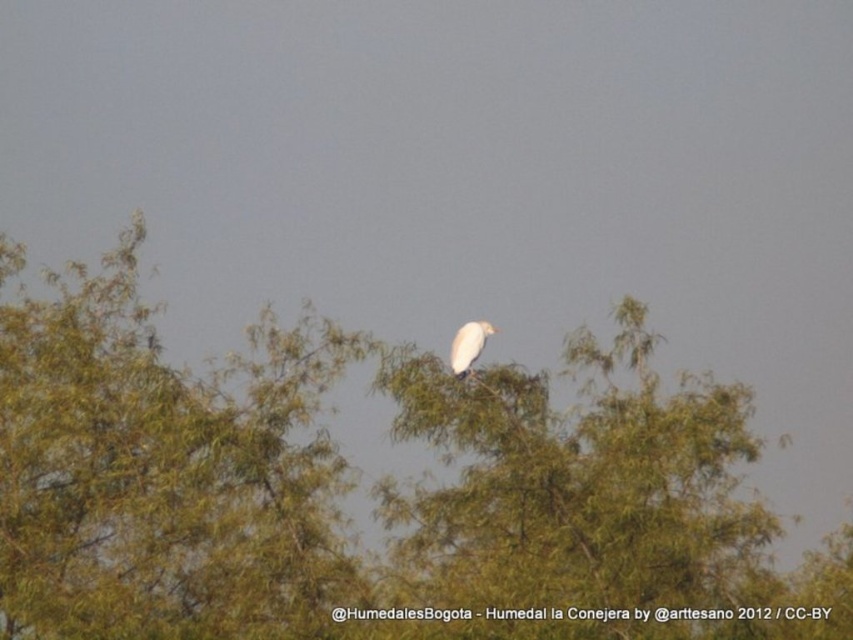
You are an ornithologist observing a white heron in a tree. The coordinates of the tree are given as point (373, 490). If you want to photograph the heron from a position that ensures the tree remains in the background without blocking the bird, where should you position yourself relative to the tree?

To ensure the green leafy tree at center remains in the background and does not block the white heron, you should position yourself in front of the tree, facing towards it. Since the tree is located at point (373, 490), positioning yourself in front would allow the bird to be the focal point while the tree stays behind.

You are a drone operator trying to navigate between two points in the image. The first point is point (131, 256) and the second point is point (469, 321). According to the scene, which point is closer to the observer?

Point (469, 321) is closer to the observer because point (131, 256) is behind it.